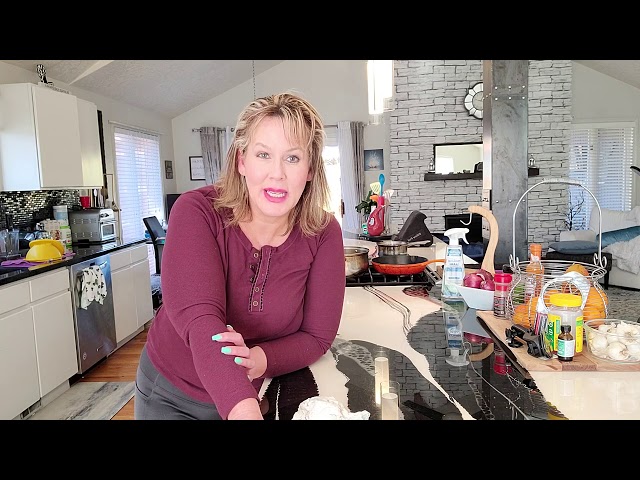
Find the location of a particular element. toaster is located at coordinates (98, 231).